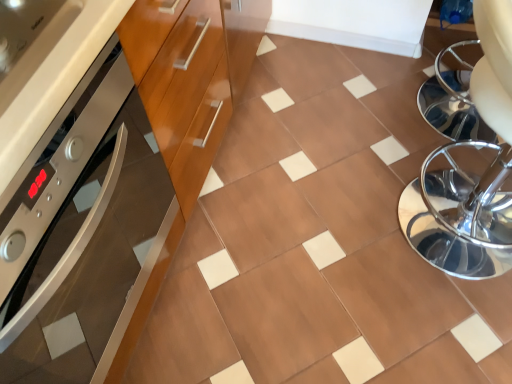
The width and height of the screenshot is (512, 384). What do you see at coordinates (320, 242) in the screenshot?
I see `brown glossy tile at center` at bounding box center [320, 242].

This screenshot has height=384, width=512. Describe the element at coordinates (114, 186) in the screenshot. I see `wooden cabinet at left` at that location.

The image size is (512, 384). What are the coordinates of `brown glossy tile at center` in the screenshot? It's located at (320, 242).

Is wooden cabinet at left shorter than polished chrome swivel chair at right?

In fact, wooden cabinet at left may be taller than polished chrome swivel chair at right.

Considering the points (66, 189) and (478, 15), which point is in front, point (66, 189) or point (478, 15)?

The point (66, 189) is in front.

Is wooden cabinet at left far away from polished chrome swivel chair at right?

No, wooden cabinet at left is in close proximity to polished chrome swivel chair at right.

Is wooden cabinet at left completely or partially outside of polished chrome swivel chair at right?

Yes, wooden cabinet at left is located beyond the bounds of polished chrome swivel chair at right.

Is brown glossy tile at center at the back of wooden cabinet at left?

That's not correct — wooden cabinet at left is not looking away from brown glossy tile at center.

Is wooden cabinet at left closer to the viewer compared to brown glossy tile at center?

Yes, it is in front of brown glossy tile at center.

Between wooden cabinet at left and brown glossy tile at center, which one has more height?

wooden cabinet at left.

Can you confirm if wooden cabinet at left is smaller than brown glossy tile at center?

No.

Looking at this image, from the image's perspective, is polished chrome swivel chair at right located beneath wooden cabinet at left?

Actually, polished chrome swivel chair at right appears above wooden cabinet at left in the image.

How many degrees apart are the facing directions of polished chrome swivel chair at right and wooden cabinet at left?

The facing directions of polished chrome swivel chair at right and wooden cabinet at left are 1.61 degrees apart.

Find the location of a particular element. The height and width of the screenshot is (384, 512). cabinetry below the polished chrome swivel chair at right (from the image's perspective) is located at coordinates (114, 186).

Between point (405, 202) and point (110, 203), which one is positioned in front?

The point (110, 203) is more forward.

Based on the photo, from the image's perspective, is polished chrome swivel chair at right above brown glossy tile at center?

No, from the image's perspective, polished chrome swivel chair at right is not over brown glossy tile at center.

In the scene shown: How different are the orientations of polished chrome swivel chair at right and brown glossy tile at center in degrees?

The angular difference between polished chrome swivel chair at right and brown glossy tile at center is 89.5 degrees.

Is polished chrome swivel chair at right positioned far away from brown glossy tile at center?

polished chrome swivel chair at right is near brown glossy tile at center, not far away.

Does polished chrome swivel chair at right lie behind brown glossy tile at center?

No, it is in front of brown glossy tile at center.

How many degrees apart are the facing directions of brown glossy tile at center and polished chrome swivel chair at right?

89.5 degrees.

From the picture: In terms of size, does brown glossy tile at center appear bigger or smaller than polished chrome swivel chair at right?

In the image, brown glossy tile at center appears to be smaller than polished chrome swivel chair at right.

Is brown glossy tile at center turned away from polished chrome swivel chair at right?

No.

Which is further, (402, 66) or (450, 220)?

The point (402, 66) is farther.

Which is closer, [494,360] or [0,192]?

Point [0,192]

How different are the orientations of brown glossy tile at center and wooden cabinet at left in degrees?

87.9 degrees separate the facing orientations of brown glossy tile at center and wooden cabinet at left.

From the image's perspective, is brown glossy tile at center located beneath wooden cabinet at left?

No, from the image's perspective, brown glossy tile at center is not below wooden cabinet at left.

Are brown glossy tile at center and wooden cabinet at left beside each other?

brown glossy tile at center and wooden cabinet at left are not in contact.

Image resolution: width=512 pixels, height=384 pixels. Find the location of `swivel chair on the right of wooden cabinet at left`. swivel chair on the right of wooden cabinet at left is located at coordinates (467, 173).

What are the coordinates of `ceramic tile that appears behind the wooden cabinet at left` in the screenshot? It's located at (320, 242).

Which object lies further to the anchor point polished chrome swivel chair at right, brown glossy tile at center or wooden cabinet at left?

wooden cabinet at left is further to polished chrome swivel chair at right.

From the image, which object appears to be farther from wooden cabinet at left, brown glossy tile at center or polished chrome swivel chair at right?

Among the two, polished chrome swivel chair at right is located further to wooden cabinet at left.

From the image, which object appears to be nearer to polished chrome swivel chair at right, wooden cabinet at left or brown glossy tile at center?

Based on the image, brown glossy tile at center appears to be nearer to polished chrome swivel chair at right.

Estimate the real-world distances between objects in this image. Which object is further from brown glossy tile at center, wooden cabinet at left or polished chrome swivel chair at right?

Among the two, wooden cabinet at left is located further to brown glossy tile at center.

When comparing their distances from brown glossy tile at center, does polished chrome swivel chair at right or wooden cabinet at left seem closer?

polished chrome swivel chair at right lies closer to brown glossy tile at center than the other object.

From the image, which object appears to be nearer to wooden cabinet at left, polished chrome swivel chair at right or brown glossy tile at center?

brown glossy tile at center lies closer to wooden cabinet at left than the other object.

You are a GUI agent. You are given a task and a screenshot of the screen. Output one action in this format:
    pyautogui.click(x=<x>, y=<y>)
    Task: Click on the ceramic tile between wooden cabinet at left and polished chrome swivel chair at right
    This screenshot has width=512, height=384.
    Given the screenshot: What is the action you would take?
    pos(320,242)